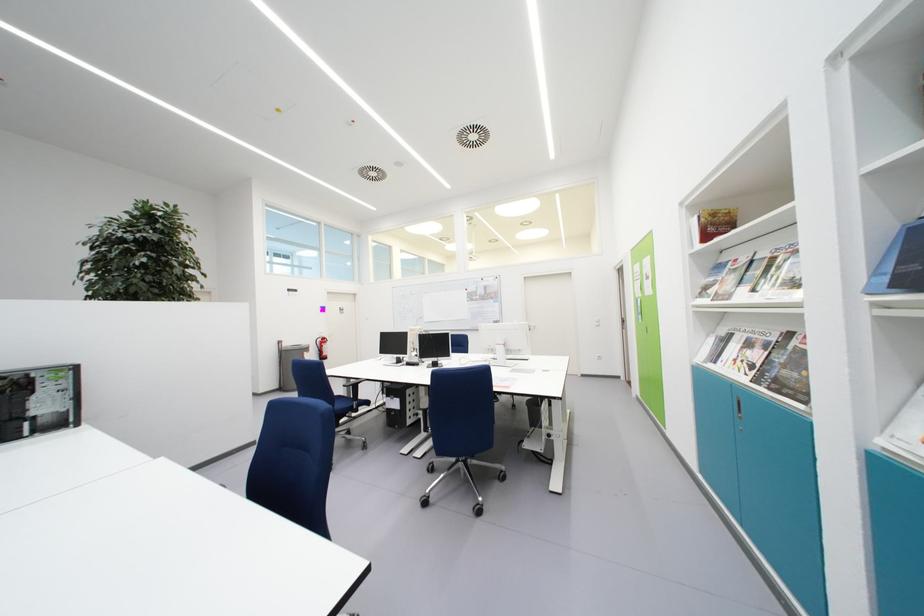
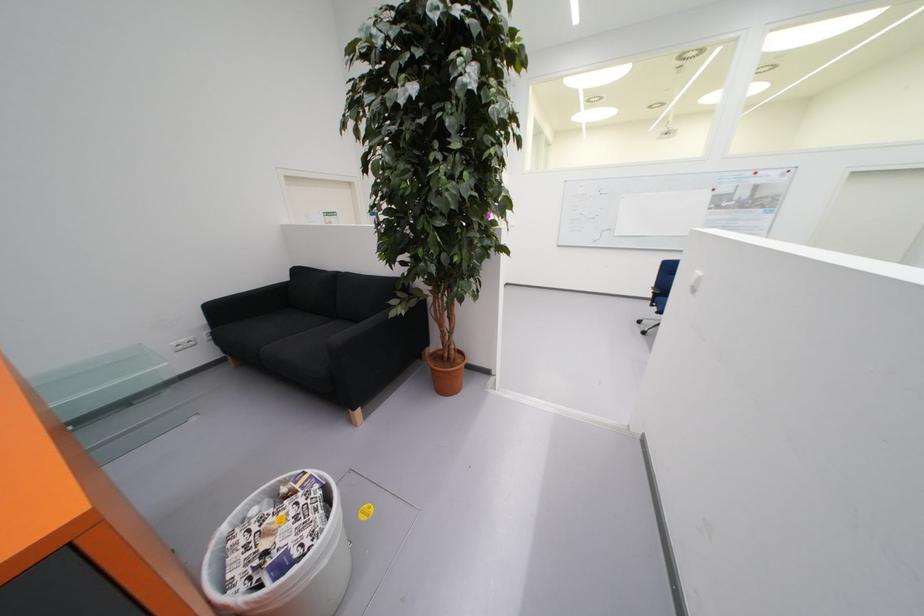
What movement of the cameraman would produce the second image?

The cameraman walked toward left, forward.